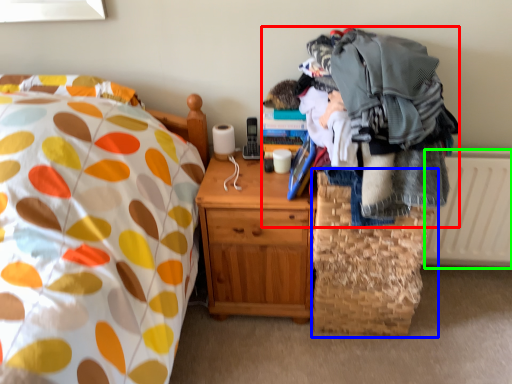
Question: Which object is positioned closest to clothing (highlighted by a red box)? Select from basket (highlighted by a blue box) and radiator (highlighted by a green box).

Choices:
 (A) basket
 (B) radiator

Answer: (A)